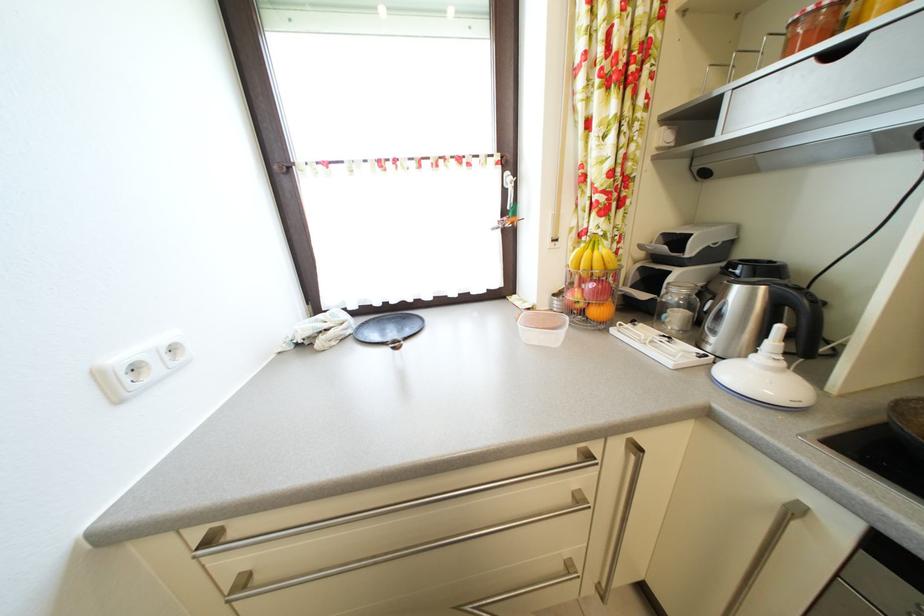
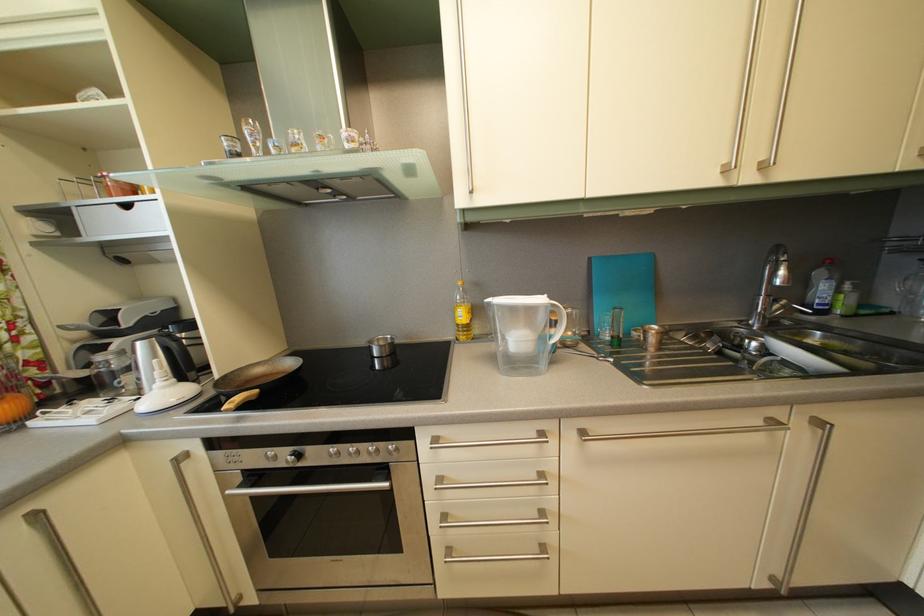
Question: The first image is from the beginning of the video and the second image is from the end. How did the camera likely rotate when shooting the video?

Choices:
 (A) Left
 (B) Right
 (C) Up
 (D) Down

Answer: (B)